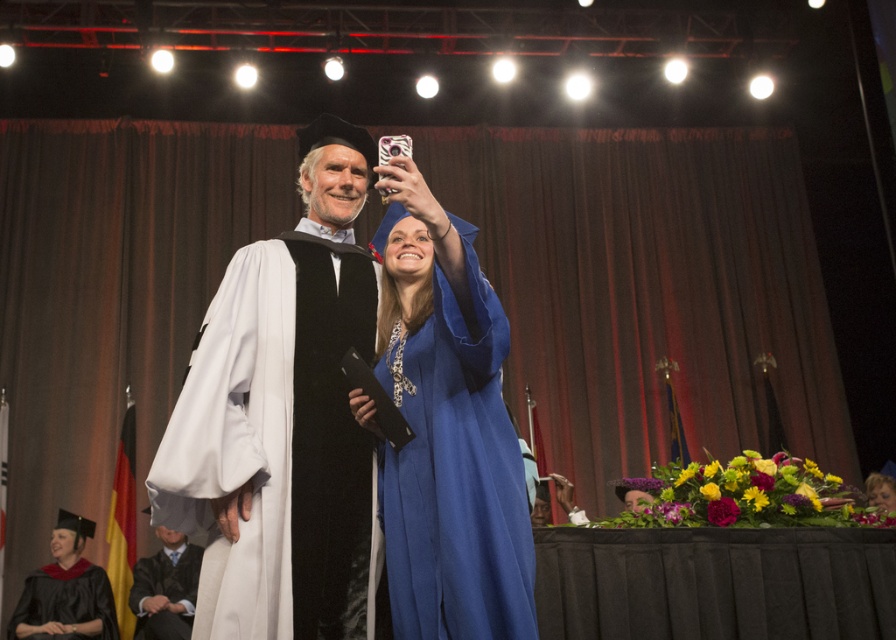
Question: Considering the relative positions of matte white gown at center and blue satin gown at center in the image provided, where is matte white gown at center located with respect to blue satin gown at center?

Choices:
 (A) above
 (B) below

Answer: (A)

Question: Is matte white gown at center positioned behind blue satin gown at center?

Choices:
 (A) no
 (B) yes

Answer: (B)

Question: Which object is farther from the camera taking this photo?

Choices:
 (A) blue satin gown at center
 (B) matte black graduation gown at lower left
 (C) white velvet gown at center
 (D) matte white gown at center

Answer: (B)

Question: Can you confirm if matte white gown at center is positioned to the right of blue satin gown at center?

Choices:
 (A) no
 (B) yes

Answer: (A)

Question: Which object appears farthest from the camera in this image?

Choices:
 (A) matte black graduation gown at lower left
 (B) white velvet gown at center
 (C) matte white gown at center

Answer: (A)

Question: Which object appears closest to the camera in this image?

Choices:
 (A) white velvet gown at center
 (B) matte black graduation gown at lower left
 (C) blue satin gown at center
 (D) matte black gown at lower left

Answer: (C)